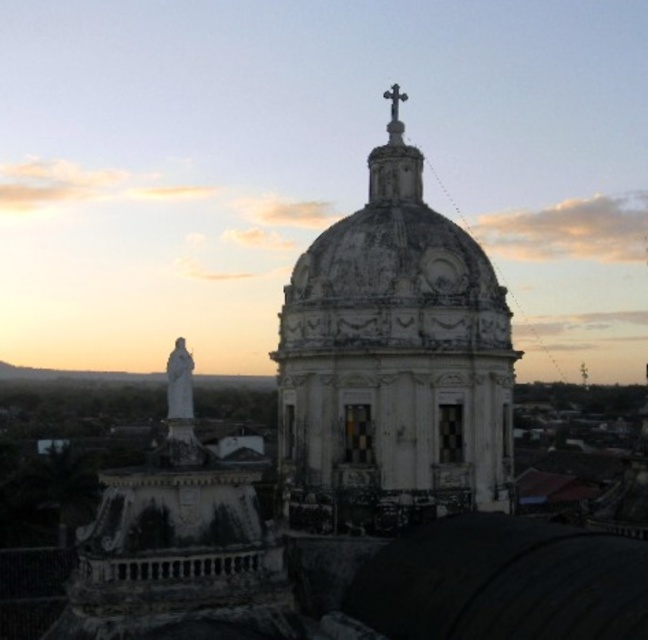
You are an architect analyzing the spatial layout of the scene. The white stone dome at center is positioned at coordinates 0.569, 0.608. If you were to draw a straight line from the top of the dome to the base of the statue on the left, would this line intersect any other objects in the scene?

The white stone dome at center is positioned at coordinates (x=393, y=364). Since there are no other objects mentioned in the scene besides the dome and the statue on the left, the line drawn from the top of the dome to the base of the statue would not intersect any other objects.

You are an architect analyzing the proportions of the dome and cross in the image. Which object has a greater width between the white stone dome at center and the polished silver cross at upper center?

The white stone dome at center has a greater width than the polished silver cross at upper center.

You are an architect planning to install a new lighting system for the white stone dome at center and the polished silver cross at upper center. The safety regulations require a minimum distance of 15 meters between the two structures for proper installation. Based on the scene description, will you need to adjust the installation plan?

The white stone dome at center is 14.64 meters from the polished silver cross at upper center. Since the required minimum distance is 15 meters, adjustments to the installation plan will be necessary to meet safety regulations.